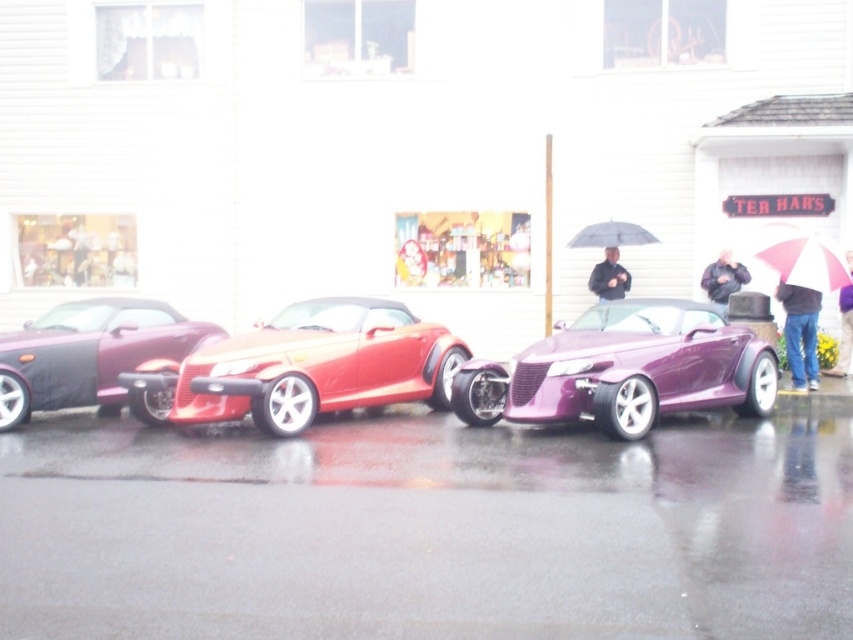
Question: Based on their relative distances, which object is farther from the jeans at lower right?

Choices:
 (A) shiny red convertible at left
 (B) black leather jacket at center

Answer: (A)

Question: Can you confirm if shiny red convertible at left is positioned above black leather jacket at center?

Choices:
 (A) no
 (B) yes

Answer: (A)

Question: Does jeans at lower right come behind black leather jacket at center?

Choices:
 (A) yes
 (B) no

Answer: (B)

Question: Which object is the farthest from the metallic purple car at center?

Choices:
 (A) dark gray jacket at center
 (B) black leather jacket at center
 (C) pink fabric umbrella at upper right
 (D) shiny metallic car at center

Answer: (C)

Question: Does shiny metallic car at center appear over jeans at lower right?

Choices:
 (A) yes
 (B) no

Answer: (B)

Question: Which of the following is the closest to the observer?

Choices:
 (A) (569, 248)
 (B) (825, 269)
 (C) (850, 340)

Answer: (B)